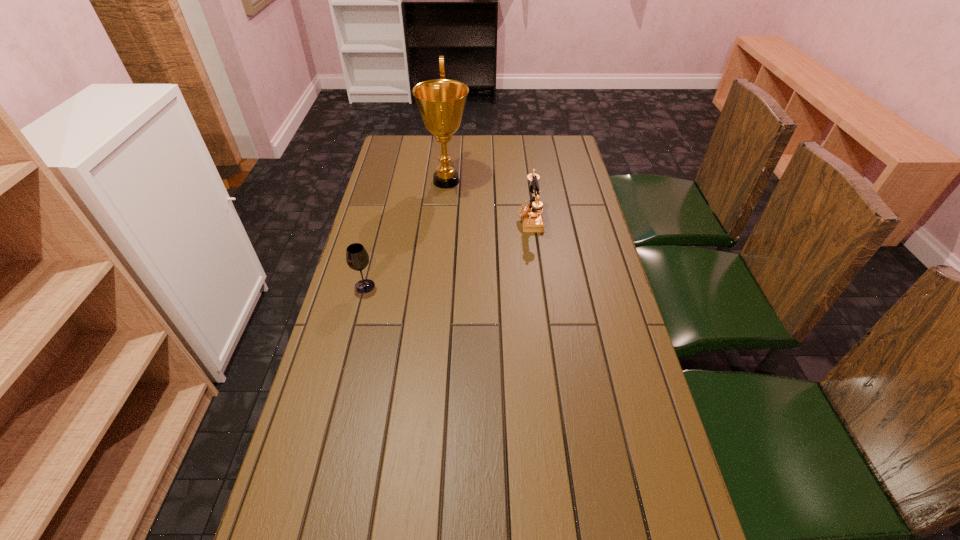
Where is `vacant space in between the tallest object and the nearest object`? vacant space in between the tallest object and the nearest object is located at coordinates (405, 234).

You are a GUI agent. You are given a task and a screenshot of the screen. Output one action in this format:
    pyautogui.click(x=<x>, y=<y>)
    Task: Click on the free space between the leftmost object and the award
    This screenshot has height=540, width=960.
    Given the screenshot: What is the action you would take?
    pyautogui.click(x=405, y=234)

Image resolution: width=960 pixels, height=540 pixels. I want to click on unoccupied area between the second farthest object and the nearest object, so click(x=447, y=253).

Where is `vacant space that is in between the award and the nearest object`? The width and height of the screenshot is (960, 540). vacant space that is in between the award and the nearest object is located at coordinates (405, 234).

You are a GUI agent. You are given a task and a screenshot of the screen. Output one action in this format:
    pyautogui.click(x=<x>, y=<y>)
    Task: Click on the object that can be found as the closest to the tallest object
    The image size is (960, 540).
    Given the screenshot: What is the action you would take?
    pyautogui.click(x=532, y=220)

Identify the location of the second closest object to the tallest object. The height and width of the screenshot is (540, 960). (357, 258).

Where is `free space that satisfies the following two spatial constraints: 1. on the dial of the rightmost object; 2. on the front side of the leftmost object`? Image resolution: width=960 pixels, height=540 pixels. free space that satisfies the following two spatial constraints: 1. on the dial of the rightmost object; 2. on the front side of the leftmost object is located at coordinates (539, 286).

At what (x,y) coordinates should I click in order to perform the action: click on free region that satisfies the following two spatial constraints: 1. on the front view with handles of the tallest object; 2. on the front side of the wineglass. Please return your answer as a coordinate pair (x, y). This screenshot has height=540, width=960. Looking at the image, I should click on (436, 286).

The image size is (960, 540). In order to click on vacant space that satisfies the following two spatial constraints: 1. on the front view with handles of the tallest object; 2. on the front side of the wineglass in this screenshot , I will do `click(436, 286)`.